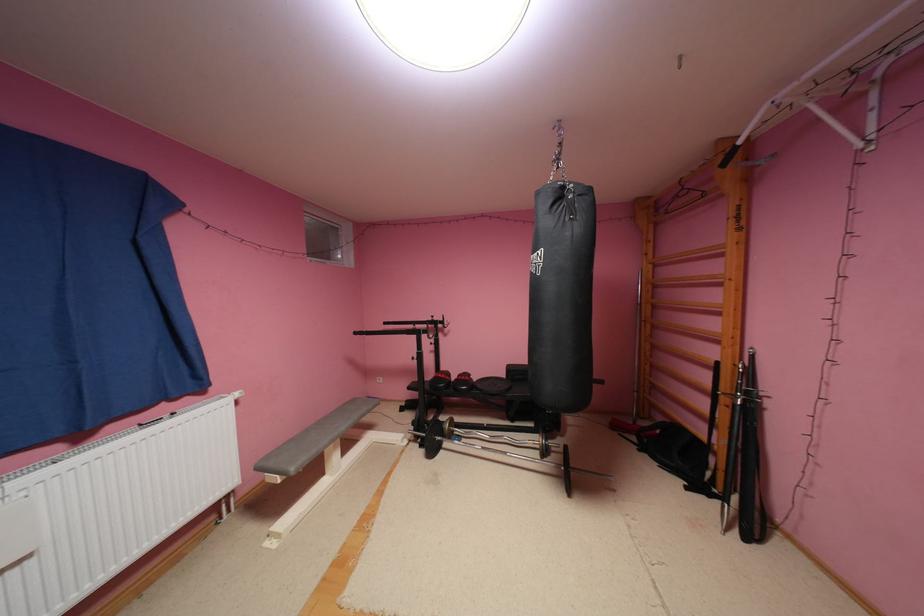
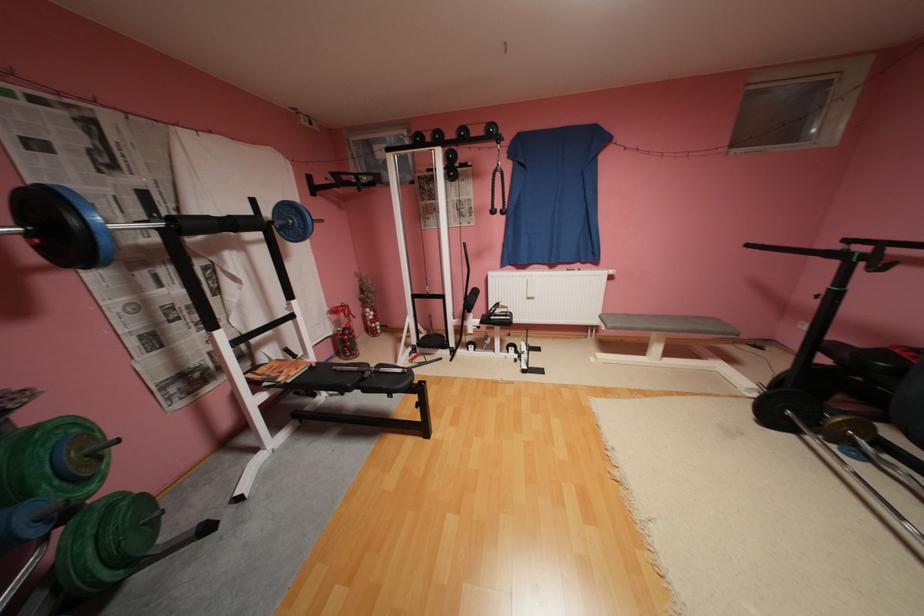
The point at (x=365, y=333) is marked in the first image. Where is the corresponding point in the second image?

(757, 246)